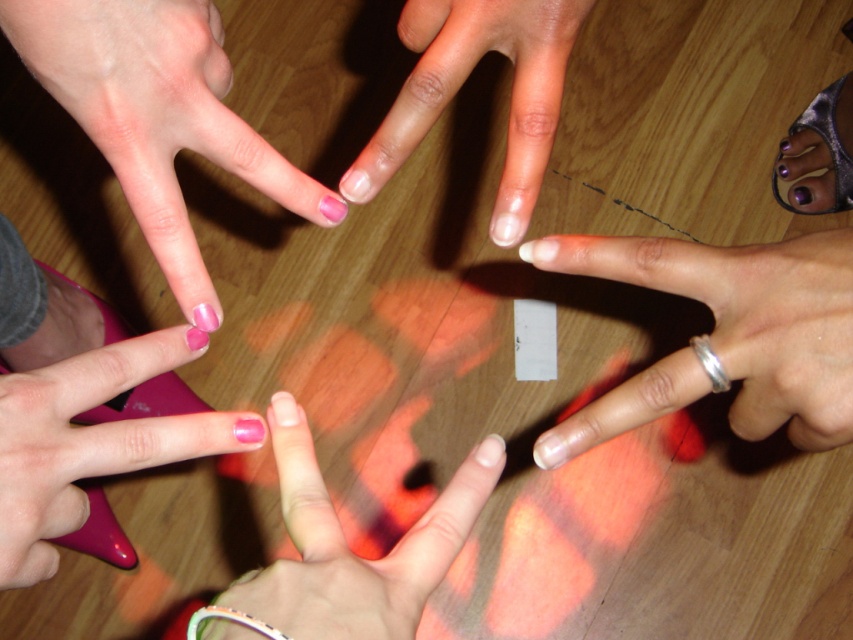
Which is in front, point (10, 577) or point (206, 616)?

Point (206, 616) is in front.

The image size is (853, 640). What do you see at coordinates (91, 440) in the screenshot? I see `pink glossy nail at lower left` at bounding box center [91, 440].

What do you see at coordinates (91, 440) in the screenshot?
I see `pink glossy nail at lower left` at bounding box center [91, 440].

The width and height of the screenshot is (853, 640). I want to click on pink glossy nail at lower left, so click(91, 440).

Consider the image. Is pink glossy nail at lower left positioned at the back of silver metallic bracelet at lower right?

No, pink glossy nail at lower left is closer to the viewer.

Between point (135, 364) and point (709, 356), which one is positioned in front?

Point (709, 356) is more forward.

Does point (233, 442) come in front of point (714, 364)?

No, (233, 442) is further to viewer.

Find the location of a particular element. This screenshot has height=640, width=853. pink glossy nail at lower left is located at coordinates (91, 440).

Is pink matte nails at center further to camera compared to pink polished nails at center?

No, it is in front of pink polished nails at center.

Between pink matte nails at center and pink polished nails at center, which one has more height?

Standing taller between the two is pink matte nails at center.

Does point (283, 179) lie behind point (572, 28)?

Yes, point (283, 179) is behind point (572, 28).

You are a GUI agent. You are given a task and a screenshot of the screen. Output one action in this format:
    pyautogui.click(x=<x>, y=<y>)
    Task: Click on the pink matte nails at center
    This screenshot has height=640, width=853.
    Given the screenshot: What is the action you would take?
    pyautogui.click(x=157, y=116)